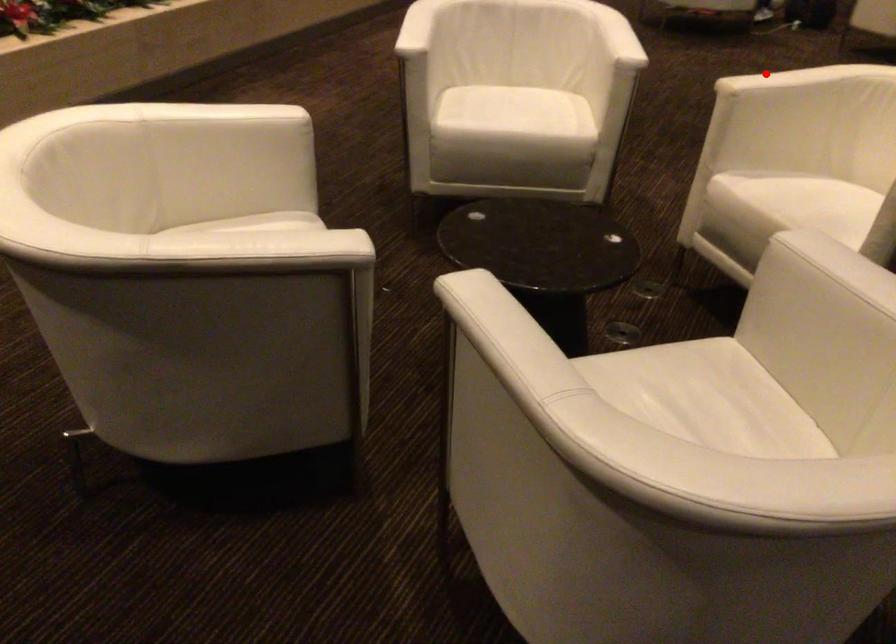
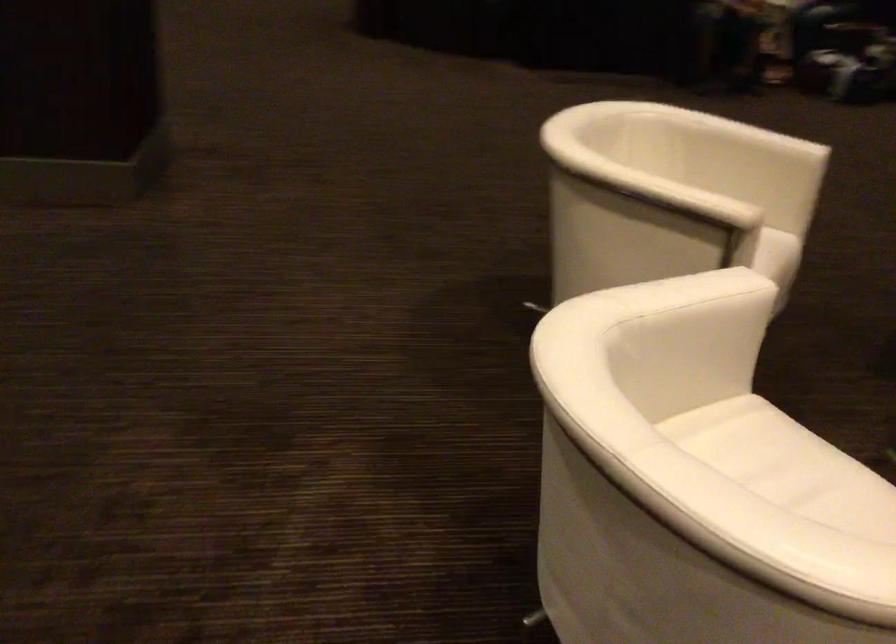
Question: I am providing you with two images of the same scene from different viewpoints. Given a red point in image1, look at the same physical point in image2. Is it:

Choices:
 (A) Closer to the viewpoint
 (B) Farther from the viewpoint

Answer: (A)